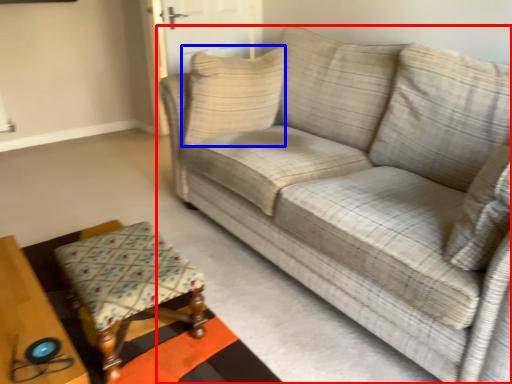
Question: Which object appears closest to the camera in this image, studio couch (highlighted by a red box) or pillow (highlighted by a blue box)?

Choices:
 (A) studio couch
 (B) pillow

Answer: (A)